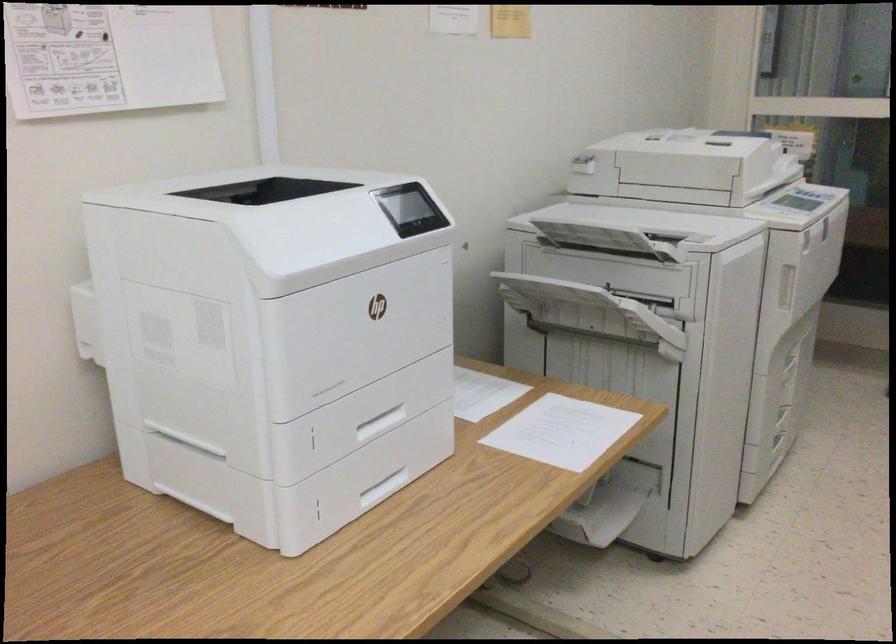
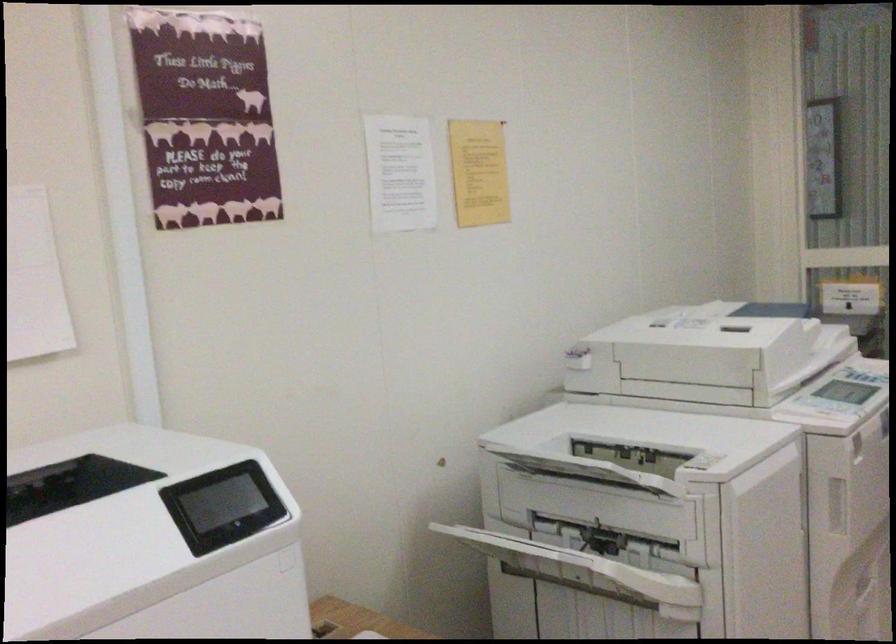
Which direction would the cameraman need to move to produce the second image?

The cameraman moved toward right, forward.